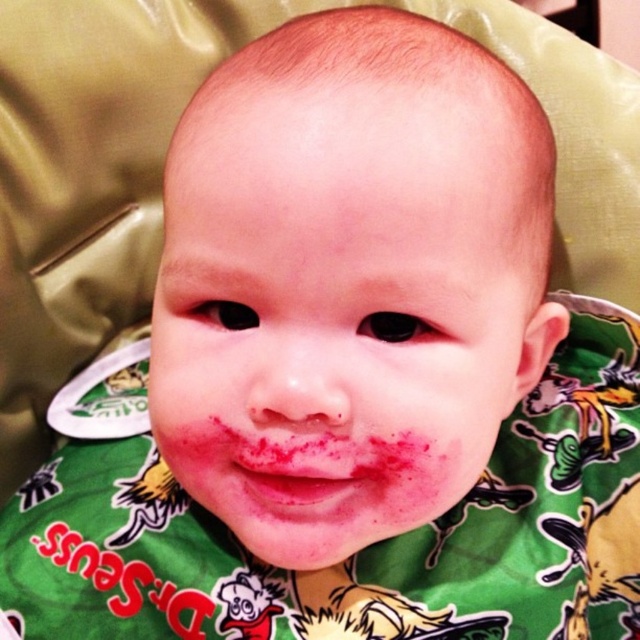
Question: Is the position of smooth skin face at center more distant than that of pink matte lips at center?

Choices:
 (A) yes
 (B) no

Answer: (B)

Question: Does smooth skin face at center lie in front of pink matte lips at center?

Choices:
 (A) yes
 (B) no

Answer: (A)

Question: Which of the following is the farthest from the observer?

Choices:
 (A) smooth skin face at center
 (B) pink matte lips at center

Answer: (B)

Question: Is smooth skin face at center wider than pink matte lips at center?

Choices:
 (A) yes
 (B) no

Answer: (A)

Question: Which point is farther to the camera?

Choices:
 (A) click(189, 284)
 (B) click(356, 470)

Answer: (A)